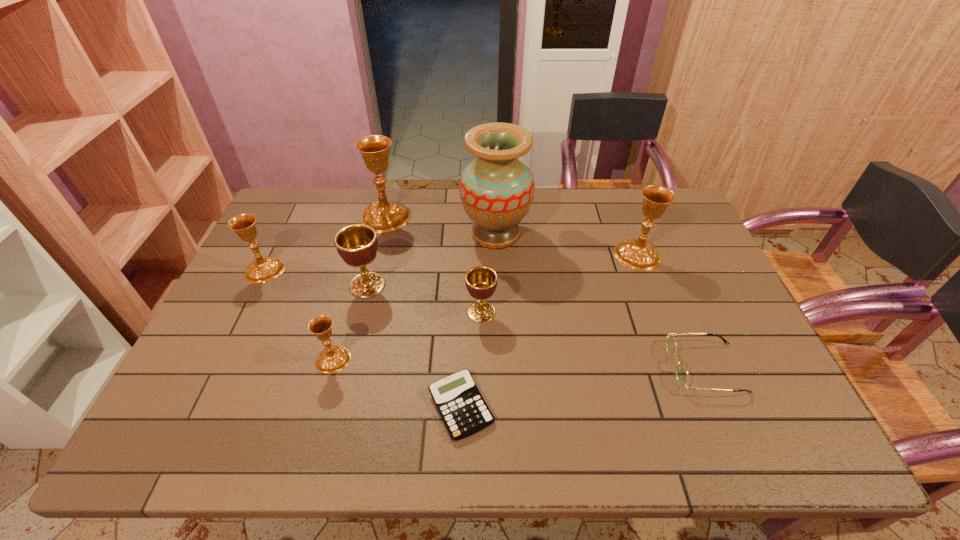
Image resolution: width=960 pixels, height=540 pixels. What are the coordinates of `vase` in the screenshot? It's located at (497, 189).

Where is `the tallest chalice`? The image size is (960, 540). the tallest chalice is located at coordinates (384, 216).

Where is `the biggest gold chalice`? the biggest gold chalice is located at coordinates (384, 216).

Image resolution: width=960 pixels, height=540 pixels. Find the location of `the rightmost chalice`. the rightmost chalice is located at coordinates (638, 254).

Identify the location of the third smallest gold chalice. The height and width of the screenshot is (540, 960). (638, 254).

Where is `the leftmost object`? the leftmost object is located at coordinates (262, 269).

Identify the location of the leftmost chalice. (262, 269).

The width and height of the screenshot is (960, 540). Find the location of `the bigger golden chalice`. the bigger golden chalice is located at coordinates (357, 244).

Locate an element on the screen. the farther golden chalice is located at coordinates (357, 244).

Identify the location of the fifth farthest chalice. The height and width of the screenshot is (540, 960). (481, 281).